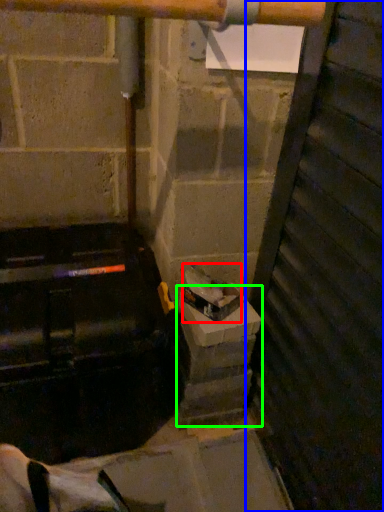
Question: Which object is positioned closest to garbage (highlighted by a red box)? Select from door (highlighted by a blue box) and concrete (highlighted by a green box).

Choices:
 (A) door
 (B) concrete

Answer: (B)